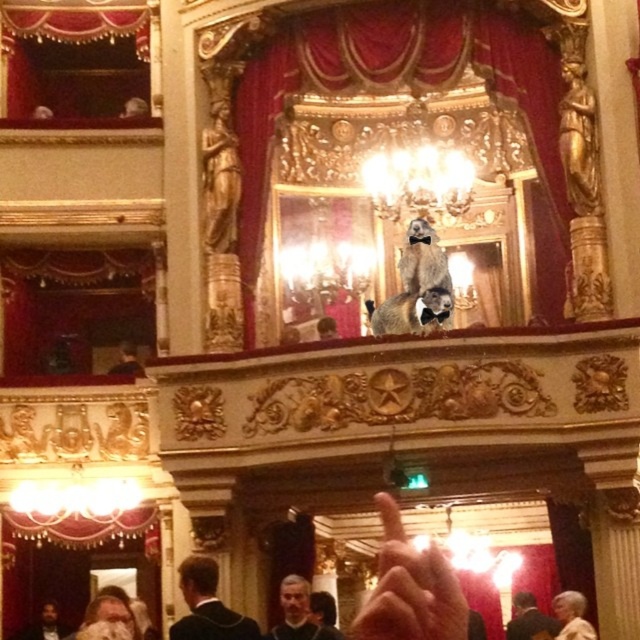
You are standing in the ornate theater interior and want to determine which of the two points, point (182, 586) or point (38, 620), is closer to you. Based on the scene description, which point is nearer?

Point (182, 586) is closer to the viewer than point (38, 620).

You are standing in the theater and see the point at coordinates (397, 88). What is the object at that point?

The point at coordinates (397, 88) is on the red velvet curtain at center.